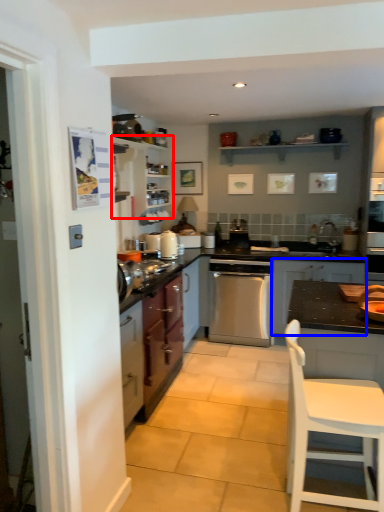
Question: Which object appears closest to the camera in this image, cabinetry (highlighted by a red box) or cabinetry (highlighted by a blue box)?

Choices:
 (A) cabinetry
 (B) cabinetry

Answer: (B)